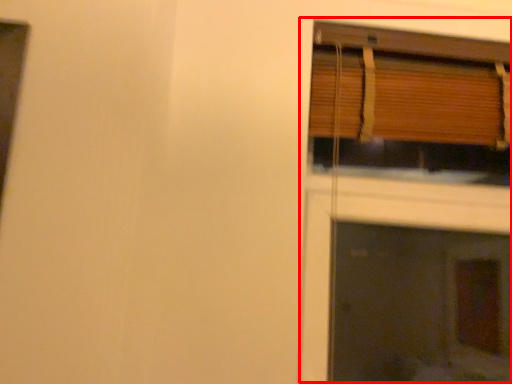
Question: From the image's perspective, considering the relative positions of fireplace (annotated by the red box) and window in the image provided, where is fireplace (annotated by the red box) located with respect to the staircase?

Choices:
 (A) below
 (B) above

Answer: (A)